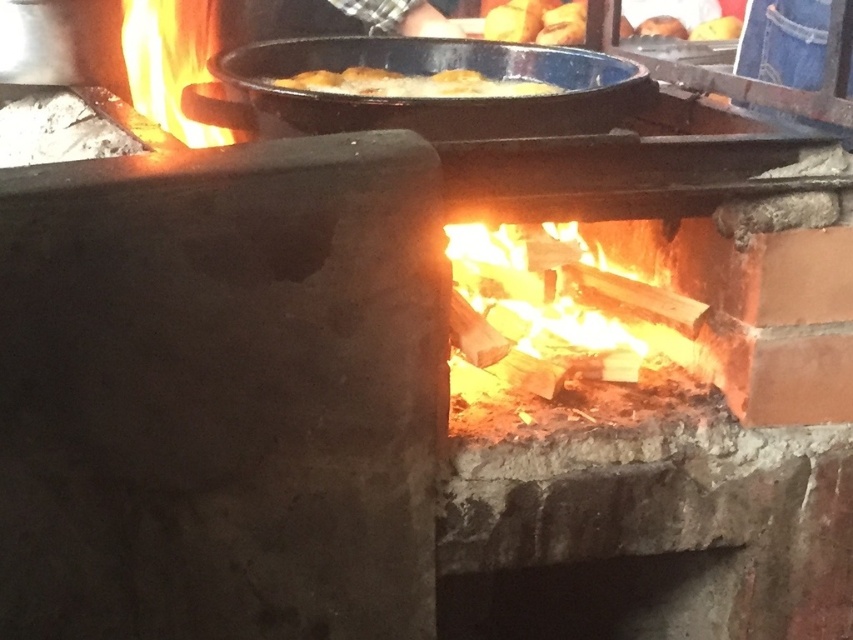
Which is behind, point (540, 420) or point (590, 68)?

The point (590, 68) is behind.

Can you confirm if charcoal wood fire at center is wider than blue enameled cast iron wok at upper center?

No.

Find the location of a particular element. This screenshot has height=640, width=853. charcoal wood fire at center is located at coordinates (566, 353).

Is charcoal wood fire at center taller than golden crispy bread at upper center?

Yes, charcoal wood fire at center is taller than golden crispy bread at upper center.

Which is behind, point (486, 298) or point (358, 81)?

Positioned behind is point (358, 81).

Identify the location of charcoal wood fire at center. The image size is (853, 640). click(x=566, y=353).

Does blue enameled cast iron wok at upper center appear under golden crispy bread at upper center?

No.

Who is more distant from viewer, (260,51) or (329,84)?

The point (260,51) is behind.

Does point (405, 118) come closer to viewer compared to point (328, 90)?

Yes, point (405, 118) is in front of point (328, 90).

The height and width of the screenshot is (640, 853). Identify the location of blue enameled cast iron wok at upper center. (440, 99).